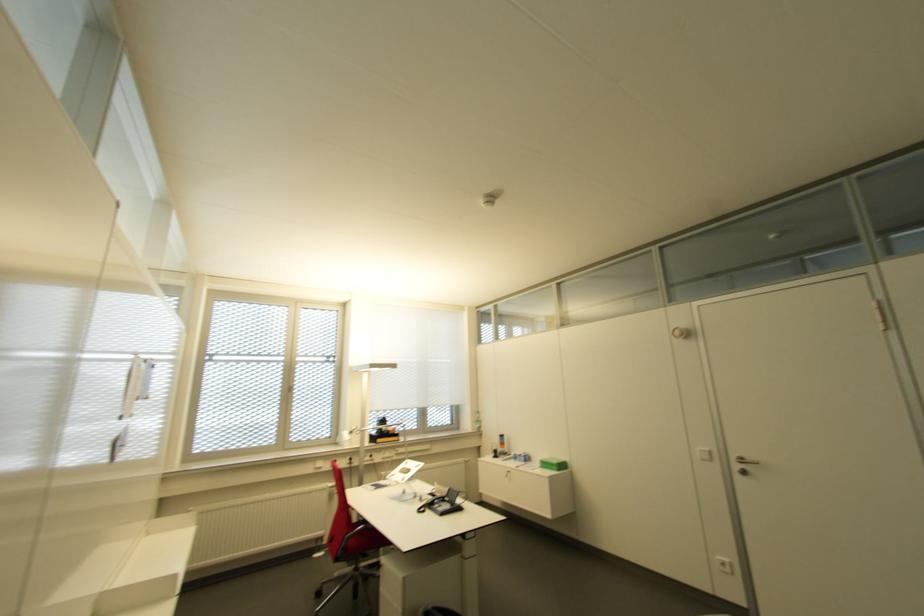
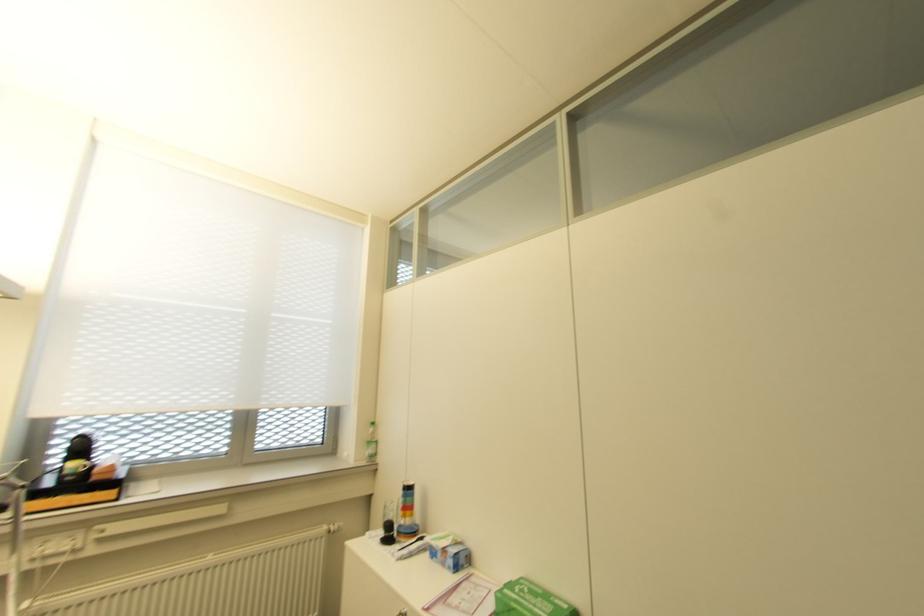
Find the pixel in the second image that matches [478,428] in the first image.

(372, 455)